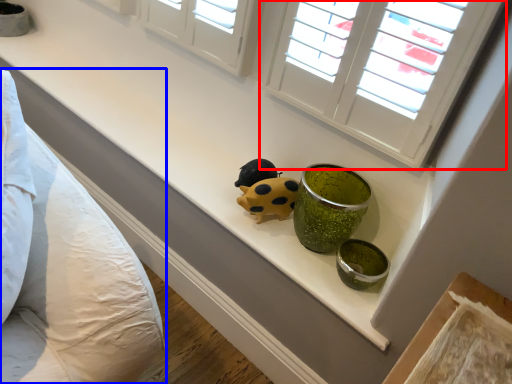
Question: Which object appears closest to the camera in this image, window (highlighted by a red box) or bedding (highlighted by a blue box)?

Choices:
 (A) window
 (B) bedding

Answer: (B)